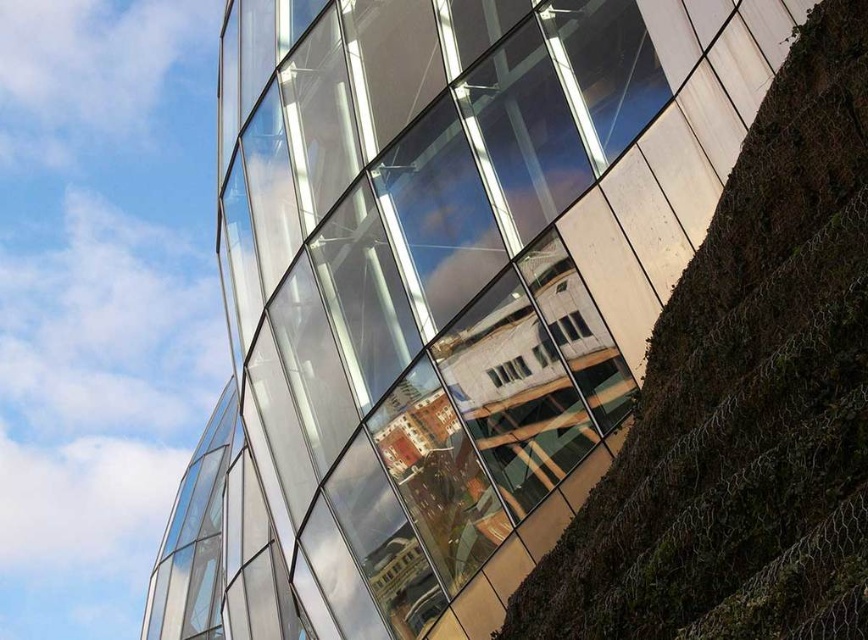
Is transparent glass windows at center to the left of green mossy hillside at right from the viewer's perspective?

Yes, transparent glass windows at center is to the left of green mossy hillside at right.

I want to click on transparent glass windows at center, so click(x=428, y=298).

Locate an element on the screen. This screenshot has height=640, width=868. transparent glass windows at center is located at coordinates (428, 298).